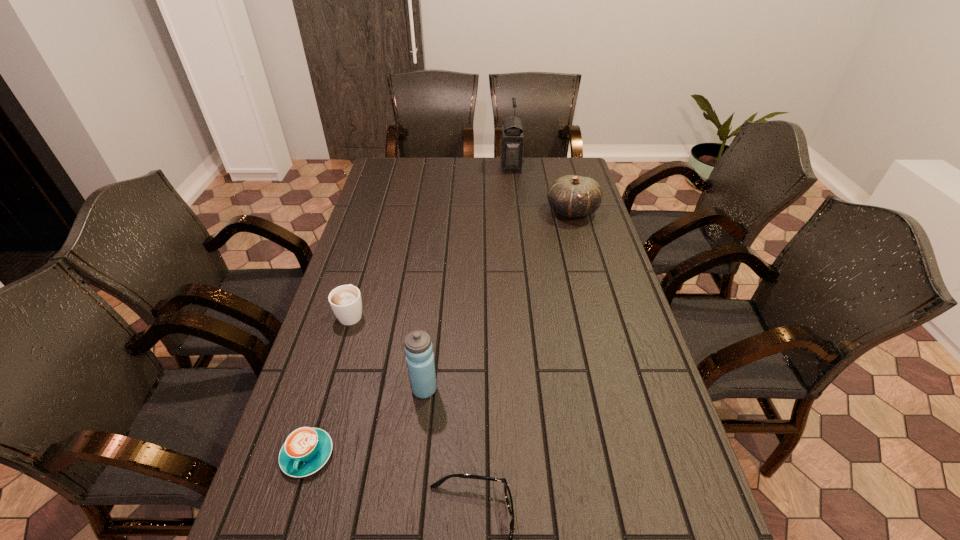
The image size is (960, 540). Identify the location of the farthest object. (511, 140).

Identify the location of the second object from right to left. The width and height of the screenshot is (960, 540). (511, 140).

The image size is (960, 540). I want to click on water bottle, so click(418, 348).

In order to click on the third nearest object in this screenshot , I will do `click(418, 348)`.

Locate an element on the screen. The image size is (960, 540). gourd is located at coordinates (573, 196).

The height and width of the screenshot is (540, 960). I want to click on the fifth nearest object, so click(573, 196).

The width and height of the screenshot is (960, 540). Identify the location of the third farthest object. (345, 301).

Where is `the taller cappuccino`? Image resolution: width=960 pixels, height=540 pixels. the taller cappuccino is located at coordinates (345, 301).

Find the location of a particular element. The image size is (960, 540). the fifth farthest object is located at coordinates (306, 450).

Where is `the shorter cappuccino`? the shorter cappuccino is located at coordinates (306, 450).